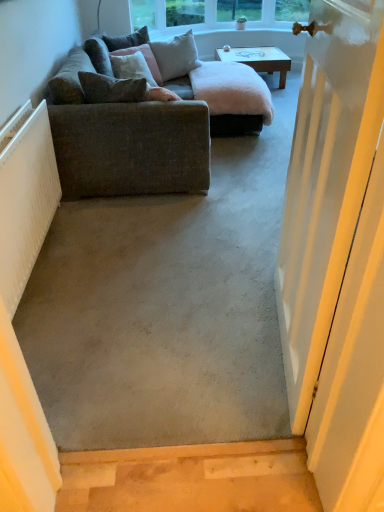
Question: Should I look upward or downward to see textured gray couch at left?

Choices:
 (A) up
 (B) down

Answer: (A)

Question: Is velvet brown pillow at upper left, which is the 3th pillow from back to front, placed right next to white ribbed radiator at left?

Choices:
 (A) yes
 (B) no

Answer: (B)

Question: From the image's perspective, does velvet brown pillow at upper left, which is counted as the 2th pillow, starting from the front, appear lower than white ribbed radiator at left?

Choices:
 (A) yes
 (B) no

Answer: (B)

Question: Is velvet brown pillow at upper left, which is counted as the 2th pillow, starting from the front, shorter than white ribbed radiator at left?

Choices:
 (A) yes
 (B) no

Answer: (A)

Question: Is velvet brown pillow at upper left, which is counted as the 2th pillow, starting from the front, taller than white ribbed radiator at left?

Choices:
 (A) yes
 (B) no

Answer: (B)

Question: Is velvet brown pillow at upper left, which is counted as the 2th pillow, starting from the front, behind white ribbed radiator at left?

Choices:
 (A) yes
 (B) no

Answer: (A)

Question: Does velvet brown pillow at upper left, which is the 3th pillow from back to front, have a lesser width compared to white ribbed radiator at left?

Choices:
 (A) no
 (B) yes

Answer: (A)

Question: From a real-world perspective, is white painted wood door at right physically above white ribbed radiator at left?

Choices:
 (A) no
 (B) yes

Answer: (B)

Question: From the image's perspective, is white painted wood door at right on top of white ribbed radiator at left?

Choices:
 (A) yes
 (B) no

Answer: (B)

Question: Are white painted wood door at right and white ribbed radiator at left beside each other?

Choices:
 (A) no
 (B) yes

Answer: (A)

Question: Is white ribbed radiator at left at the back of white painted wood door at right?

Choices:
 (A) no
 (B) yes

Answer: (A)

Question: Considering the relative sizes of white painted wood door at right and white ribbed radiator at left in the image provided, is white painted wood door at right taller than white ribbed radiator at left?

Choices:
 (A) yes
 (B) no

Answer: (A)

Question: Is white painted wood door at right not within white ribbed radiator at left?

Choices:
 (A) no
 (B) yes

Answer: (B)

Question: Is the position of velvet green pillow at upper left, the fourth pillow from the front, more distant than that of velvet brown pillow at upper left, which is counted as the 2th pillow, starting from the front?

Choices:
 (A) no
 (B) yes

Answer: (B)